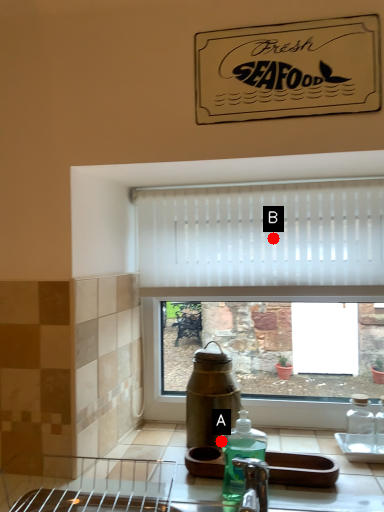
Question: Two points are circled on the image, labeled by A and B beside each circle. Which point appears closest to the camera in this image?

Choices:
 (A) A is closer
 (B) B is closer

Answer: (A)